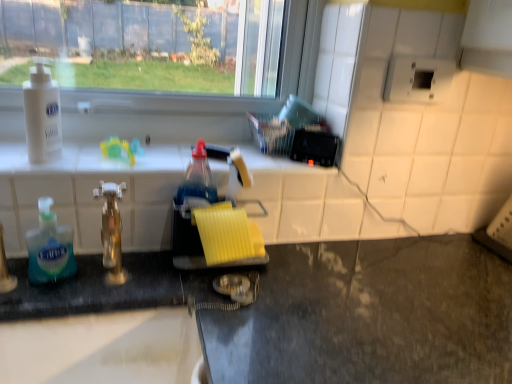
Find the location of a particular element. vacant space situated on the left part of yellow sponge at center is located at coordinates (131, 268).